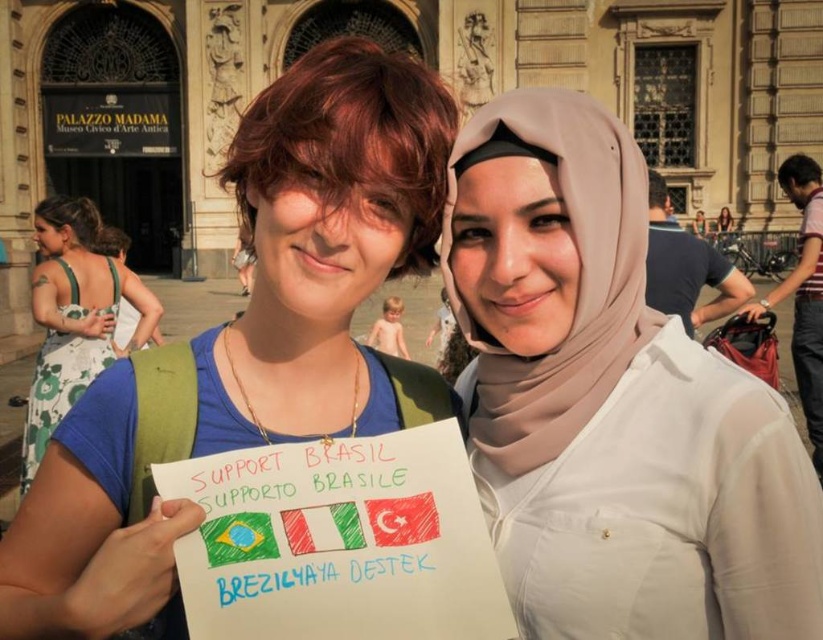
Measure the distance between point (259, 326) and camera.

A distance of 124.16 feet exists between point (259, 326) and camera.

Who is shorter, matte blue shirt at center or green floral dress at left?

With less height is green floral dress at left.

Which is behind, point (338, 268) or point (59, 289)?

Point (59, 289)

Identify the location of matte blue shirt at center. (326, 248).

Looking at this image, is green floral dress at left wider than white fabric hijab at upper center?

Yes.

Does green floral dress at left have a greater height compared to white fabric hijab at upper center?

Yes.

The height and width of the screenshot is (640, 823). What do you see at coordinates (73, 316) in the screenshot?
I see `green floral dress at left` at bounding box center [73, 316].

Locate an element on the screen. The image size is (823, 640). green floral dress at left is located at coordinates (73, 316).

Is matte blue shirt at center bigger than white fabric hijab at upper center?

Yes, matte blue shirt at center is bigger than white fabric hijab at upper center.

At what (x,y) coordinates should I click in order to perform the action: click on matte blue shirt at center. Please return your answer as a coordinate pair (x, y). This screenshot has height=640, width=823. Looking at the image, I should click on (326, 248).